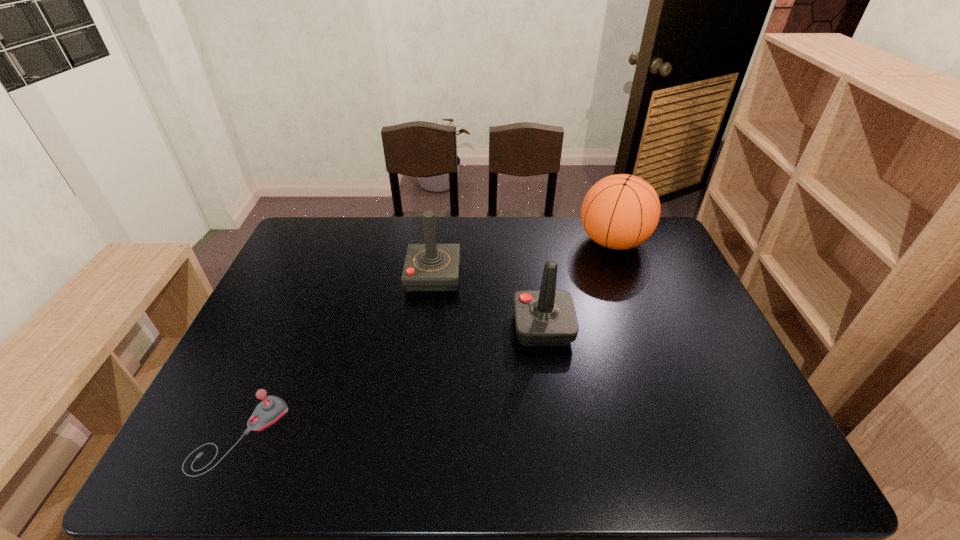
The width and height of the screenshot is (960, 540). I want to click on empty location between the third farthest object and the rightmost object, so click(x=578, y=285).

Identify the location of empty space between the second nearest joystick and the shortest object. (392, 381).

Choose which object is the third nearest neighbor to the second joystick from left to right. Please provide its 2D coordinates. Your answer should be formatted as a tuple, i.e. [(x, y)], where the tuple contains the x and y coordinates of a point satisfying the conditions above.

[(272, 408)]

Select which object appears as the third closest to the farthest joystick. Please provide its 2D coordinates. Your answer should be formatted as a tuple, i.e. [(x, y)], where the tuple contains the x and y coordinates of a point satisfying the conditions above.

[(272, 408)]

In order to click on joystick that is the second closest to the third object from right to left in this screenshot , I will do `click(272, 408)`.

At what (x,y) coordinates should I click in order to perform the action: click on the third closest joystick to the rightmost object. Please return your answer as a coordinate pair (x, y). Looking at the image, I should click on (272, 408).

Locate an element on the screen. Image resolution: width=960 pixels, height=540 pixels. blank space that satisfies the following two spatial constraints: 1. on the rectangular base of the rightmost joystick; 2. on the left side of the second joystick from right to left is located at coordinates (427, 328).

This screenshot has width=960, height=540. Find the location of `vacant region that satisfies the following two spatial constraints: 1. on the rectangular base of the farthest joystick; 2. on the front side of the leftmost joystick`. vacant region that satisfies the following two spatial constraints: 1. on the rectangular base of the farthest joystick; 2. on the front side of the leftmost joystick is located at coordinates (414, 435).

Where is `vacant position in the image that satisfies the following two spatial constraints: 1. on the back side of the rightmost object; 2. on the left side of the second farthest joystick`? The height and width of the screenshot is (540, 960). vacant position in the image that satisfies the following two spatial constraints: 1. on the back side of the rightmost object; 2. on the left side of the second farthest joystick is located at coordinates (531, 242).

At what (x,y) coordinates should I click in order to perform the action: click on blank space that satisfies the following two spatial constraints: 1. on the rectangular base of the second joystick from left to right; 2. on the left side of the second nearest object. Please return your answer as a coordinate pair (x, y). This screenshot has width=960, height=540. Looking at the image, I should click on (427, 328).